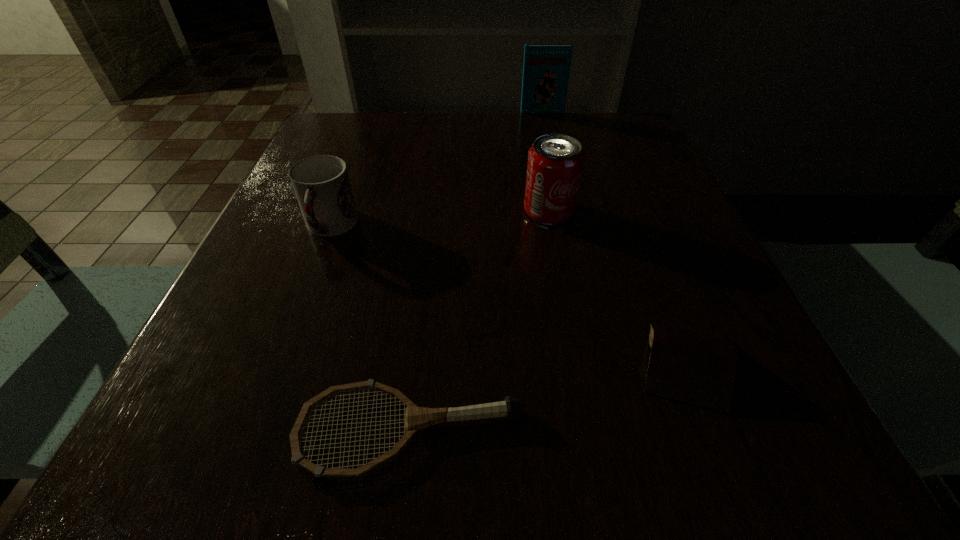
Locate an element on the screen. The width and height of the screenshot is (960, 540). vacant space that satisfies the following two spatial constraints: 1. on the side of the shortest object where the handle is located; 2. on the right side of the leftmost object is located at coordinates (252, 430).

Locate an element on the screen. Image resolution: width=960 pixels, height=540 pixels. vacant position in the image that satisfies the following two spatial constraints: 1. on the front cover of the farthest object; 2. on the left side of the nearer book is located at coordinates (598, 362).

Where is `vacant space that satisfies the following two spatial constraints: 1. on the back side of the can; 2. on the left side of the tennis racket`? vacant space that satisfies the following two spatial constraints: 1. on the back side of the can; 2. on the left side of the tennis racket is located at coordinates (435, 212).